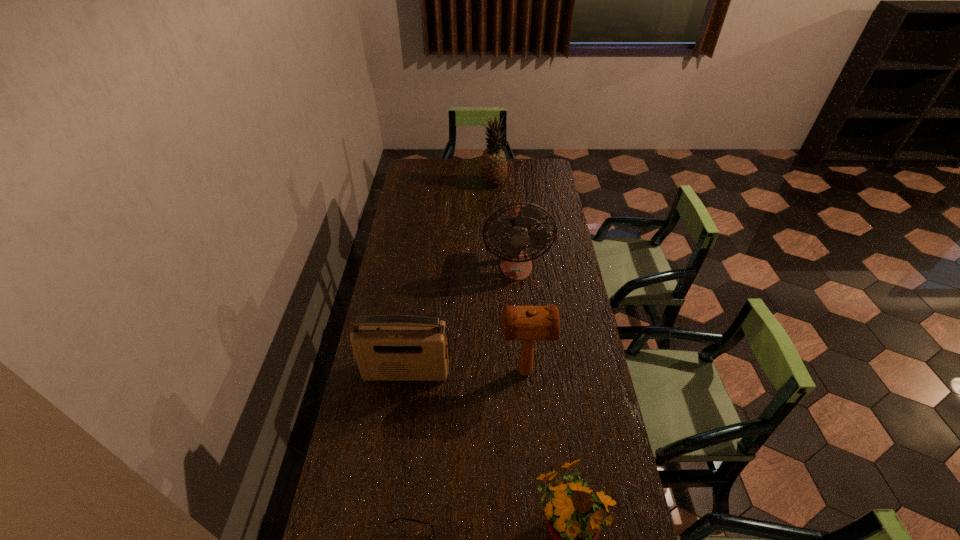
You are a GUI agent. You are given a task and a screenshot of the screen. Output one action in this format:
    pyautogui.click(x=<x>, y=<y>)
    Task: Click on the object positioned at the far edge
    
    Given the screenshot: What is the action you would take?
    pyautogui.click(x=493, y=165)

In order to click on object present at the left edge in this screenshot , I will do `click(387, 347)`.

At what (x,y) coordinates should I click in order to perform the action: click on object located at the right edge. Please return your answer as a coordinate pair (x, y). Image resolution: width=960 pixels, height=540 pixels. Looking at the image, I should click on pyautogui.click(x=515, y=264).

Find the location of a particular element. vacant space at the far edge of the desktop is located at coordinates (468, 159).

Where is `vacant space at the left edge of the desktop`? vacant space at the left edge of the desktop is located at coordinates (424, 224).

Where is `vacant position at the right edge of the desktop`? The height and width of the screenshot is (540, 960). vacant position at the right edge of the desktop is located at coordinates (547, 219).

Find the location of a particular element. free space at the far right corner of the desktop is located at coordinates (552, 180).

Locate an element on the screen. vacant space in between the radio receiver and the farthest object is located at coordinates (450, 278).

Point out which object is positioned as the second nearest to the mallet. Please provide its 2D coordinates. Your answer should be formatted as a tuple, i.e. [(x, y)], where the tuple contains the x and y coordinates of a point satisfying the conditions above.

[(573, 518)]

Locate an element on the screen. object that is the second nearest to the mallet is located at coordinates (573, 518).